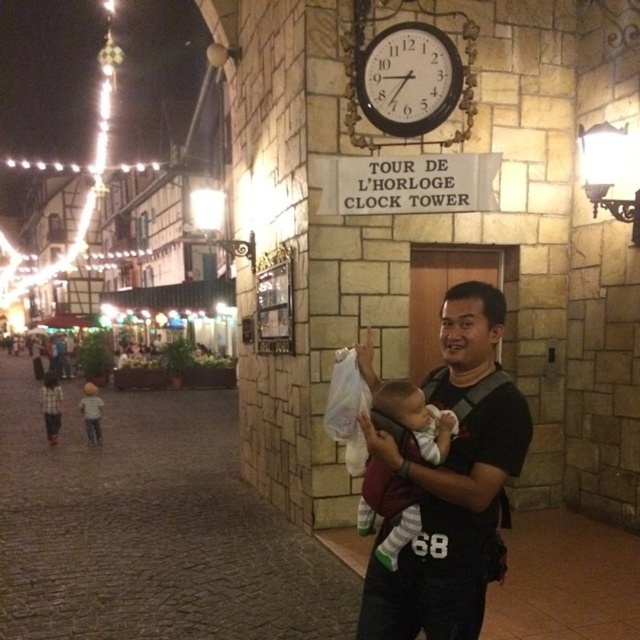
Question: Among these points, which one is nearest to the camera?

Choices:
 (A) (360, 499)
 (B) (416, 134)
 (C) (96, 432)

Answer: (A)

Question: Is black fabric baby carrier at center smaller than black metal clock at upper center?

Choices:
 (A) no
 (B) yes

Answer: (A)

Question: Which point is closer to the camera?

Choices:
 (A) light brown hair at left
 (B) black metal clock at upper center
 (C) black fabric baby carrier at center
 (D) soft white baby at center

Answer: (C)

Question: Does black metal clock at upper center appear over light brown hair at left?

Choices:
 (A) no
 (B) yes

Answer: (B)

Question: Which point appears farthest from the camera in this image?

Choices:
 (A) (371, 108)
 (B) (488, 408)

Answer: (A)

Question: Observing the image, what is the correct spatial positioning of black metal clock at upper center in reference to light brown hair at left?

Choices:
 (A) above
 (B) below

Answer: (A)